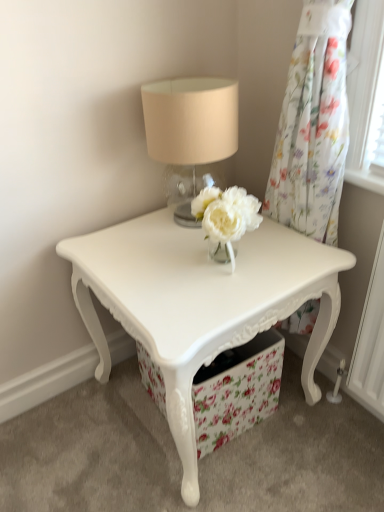
Locate an element on the screen. The height and width of the screenshot is (512, 384). unoccupied area in front of matte glass table lamp at upper center is located at coordinates (180, 257).